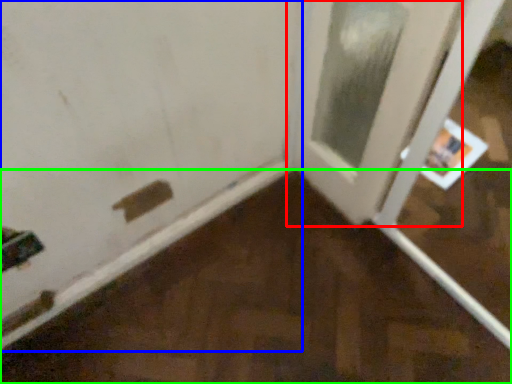
Question: Which object is the closest to the door (highlighted by a red box)? Choose among these: door (highlighted by a blue box) or plywood (highlighted by a green box).

Choices:
 (A) door
 (B) plywood

Answer: (A)